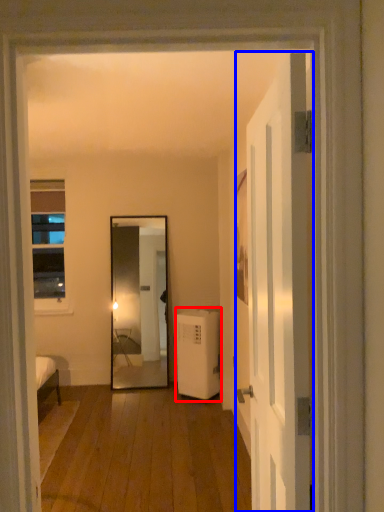
Question: Which of the following is the closest to the observer, air conditioner (highlighted by a red box) or door (highlighted by a blue box)?

Choices:
 (A) air conditioner
 (B) door

Answer: (B)